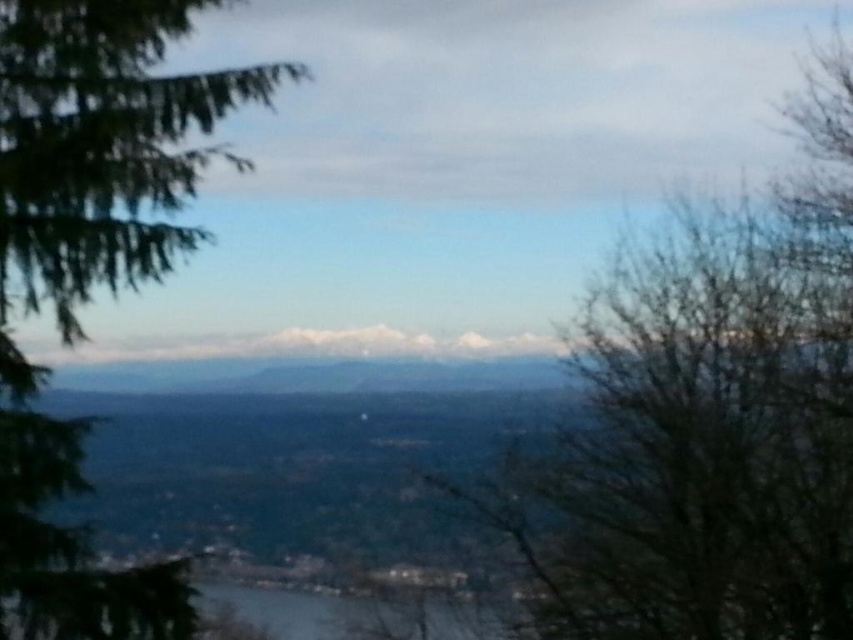
Which is behind, point (769, 461) or point (53, 202)?

The point (769, 461) is behind.

Can you confirm if bare branches at right is positioned to the left of green textured pine tree at left?

Incorrect, bare branches at right is not on the left side of green textured pine tree at left.

Which is in front, point (822, 378) or point (68, 328)?

Point (68, 328) is in front.

You are a GUI agent. You are given a task and a screenshot of the screen. Output one action in this format:
    pyautogui.click(x=<x>, y=<y>)
    Task: Click on the bare branches at right
    This screenshot has width=853, height=640.
    Given the screenshot: What is the action you would take?
    pyautogui.click(x=709, y=419)